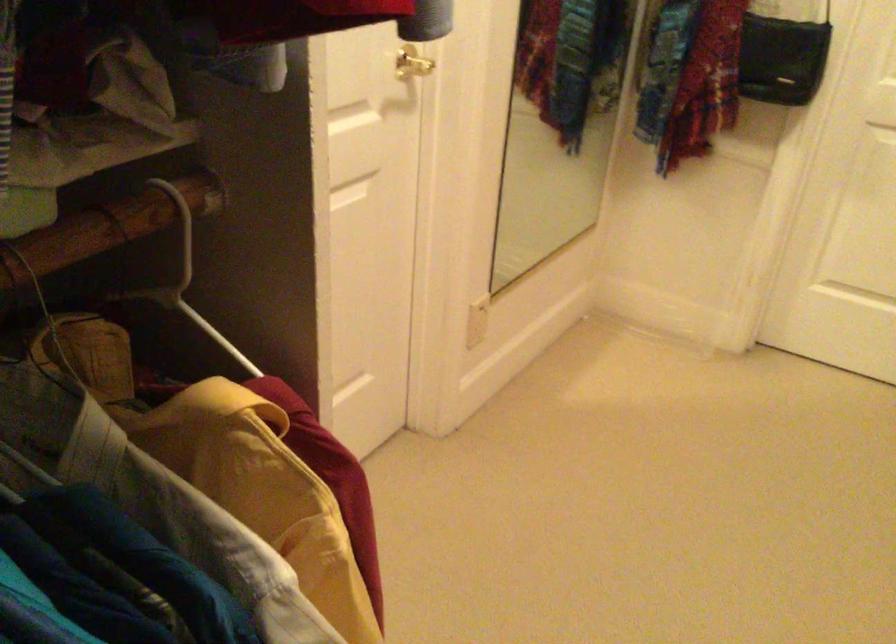
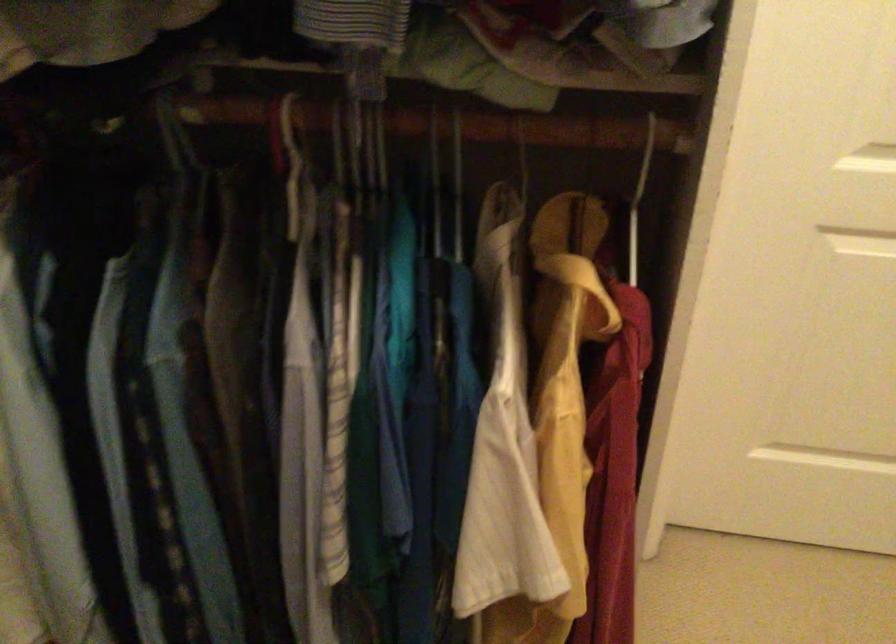
Question: Based on the continuous images, in which direction is the camera rotating? Reply with the corresponding letter.

Choices:
 (A) Left
 (B) Right
 (C) Up
 (D) Down

Answer: (A)